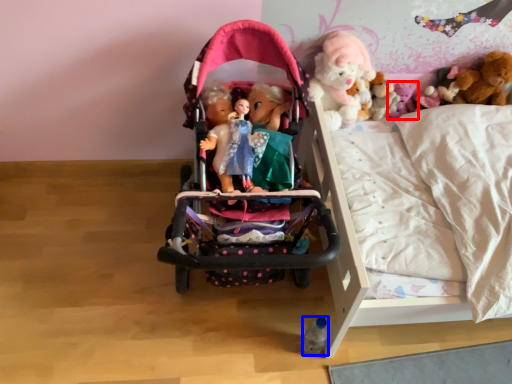
Question: Which object appears farthest to the camera in this image, toy (highlighted by a red box) or toy (highlighted by a blue box)?

Choices:
 (A) toy
 (B) toy

Answer: (A)